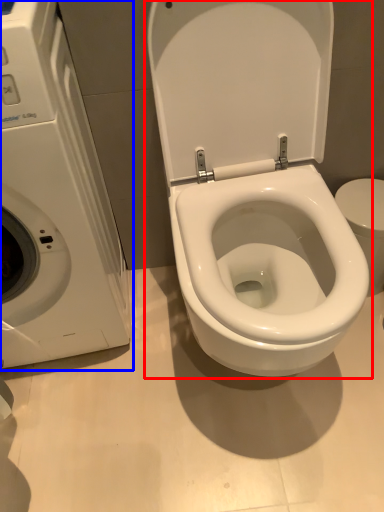
Question: Which object is further to the camera taking this photo, toilet (highlighted by a red box) or washing machine (highlighted by a blue box)?

Choices:
 (A) toilet
 (B) washing machine

Answer: (A)